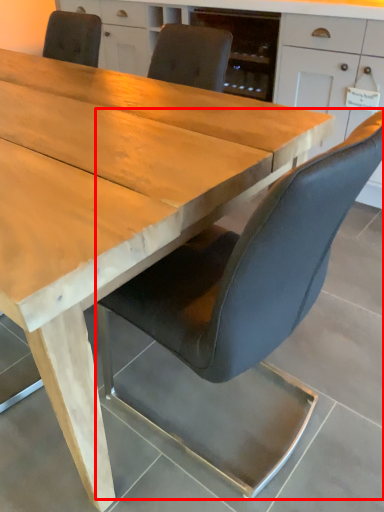
Question: From the image's perspective, what is the correct spatial positioning of chair (annotated by the red box) in reference to cabinetry?

Choices:
 (A) below
 (B) above

Answer: (A)